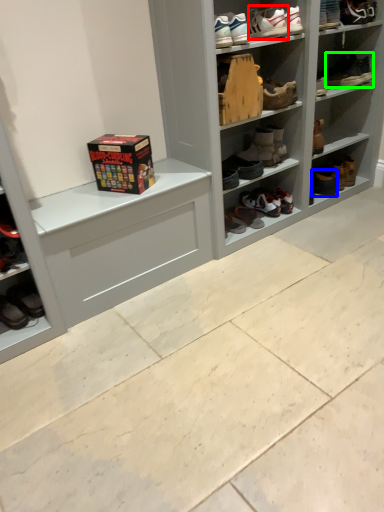
Question: Based on their relative distances, which object is farther from footwear (highlighted by a red box)? Choose from footwear (highlighted by a blue box) and footwear (highlighted by a green box).

Choices:
 (A) footwear
 (B) footwear

Answer: (A)